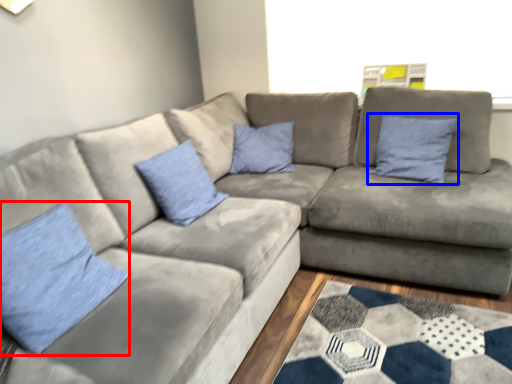
Question: Which object appears farthest to the camera in this image, pillow (highlighted by a red box) or pillow (highlighted by a blue box)?

Choices:
 (A) pillow
 (B) pillow

Answer: (B)